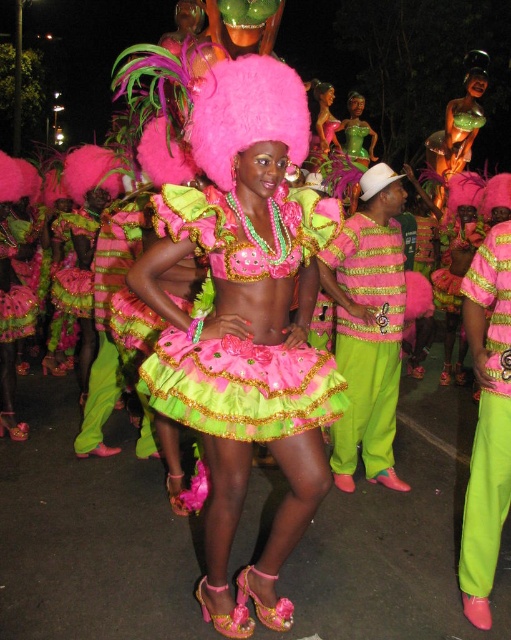
Does lime green satin pants at right appear under neon green satin pants at lower right?

Incorrect, lime green satin pants at right is not positioned below neon green satin pants at lower right.

Is point (383, 381) more distant than point (487, 568)?

Yes, it is behind point (487, 568).

Is point (401, 301) positioned behind point (492, 493)?

That is True.

Find the location of `lime green satin pants at right`. lime green satin pants at right is located at coordinates (367, 340).

Does matte pink fabric dress at center have a larger size compared to neon green satin pants at lower right?

Correct, matte pink fabric dress at center is larger in size than neon green satin pants at lower right.

Is point (153, 404) closer to viewer compared to point (484, 477)?

That is True.

The image size is (511, 640). I want to click on matte pink fabric dress at center, so click(x=242, y=387).

This screenshot has height=640, width=511. In order to click on matte pink fabric dress at center in this screenshot , I will do `click(242, 387)`.

Is shiny satin dress at center closer to the viewer compared to lime green satin pants at right?

Yes.

Is point (198, 154) less distant than point (355, 365)?

Yes, it is.

Where is `shiny satin dress at center`? shiny satin dress at center is located at coordinates (246, 323).